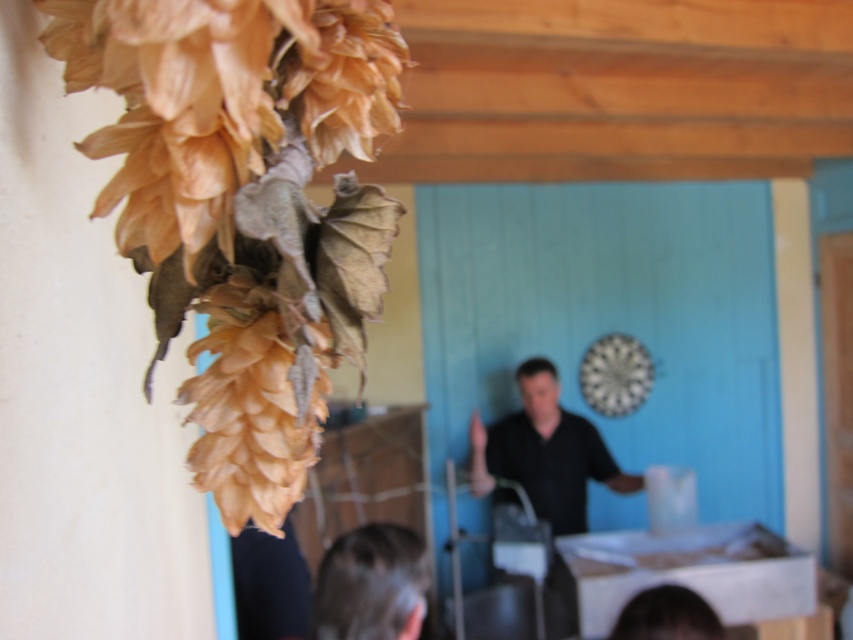
Is dark brown hair at lower center above matte black shirt at center?

No, dark brown hair at lower center is not above matte black shirt at center.

Does point (372, 636) lie behind point (531, 381)?

No, (372, 636) is in front of (531, 381).

Image resolution: width=853 pixels, height=640 pixels. What do you see at coordinates (370, 584) in the screenshot? I see `dark brown hair at lower center` at bounding box center [370, 584].

Find the location of a particular element. This screenshot has width=853, height=640. dark brown hair at lower center is located at coordinates (370, 584).

From the picture: Does white cardboard box at lower center come in front of matte black shirt at center?

Yes, white cardboard box at lower center is closer to the viewer.

How far apart are white cardboard box at lower center and matte black shirt at center?

white cardboard box at lower center and matte black shirt at center are 89.83 centimeters apart.

You are a GUI agent. You are given a task and a screenshot of the screen. Output one action in this format:
    pyautogui.click(x=<x>, y=<y>)
    Task: Click on the white cardboard box at lower center
    The image size is (853, 640).
    Given the screenshot: What is the action you would take?
    pyautogui.click(x=689, y=572)

Does white cardboard box at lower center have a greater height compared to dark brown hair at lower center?

Yes.

Looking at this image, who is taller, white cardboard box at lower center or dark brown hair at lower center?

white cardboard box at lower center

Is point (589, 632) positioned behind point (387, 616)?

That is True.

Find the location of a particular element. The width and height of the screenshot is (853, 640). white cardboard box at lower center is located at coordinates (689, 572).